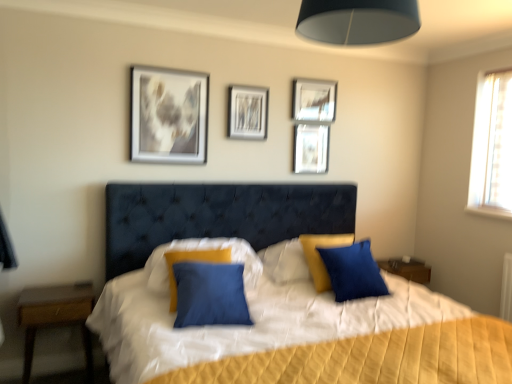
Image resolution: width=512 pixels, height=384 pixels. Describe the element at coordinates (357, 21) in the screenshot. I see `black fabric lampshade at upper center` at that location.

Consider the image. In order to face metallic silver picture frame at upper center, positioned as the 3th picture frame in right-to-left order, should I rotate leftwards or rightwards?

You should rotate left by 0.795 degrees.

Measure the distance between point [265,126] and camera.

They are 3.16 meters apart.

What do you see at coordinates (311, 149) in the screenshot? I see `matte silver picture frame at upper center, the third picture frame in the left-to-right sequence` at bounding box center [311, 149].

Where is `matte silver picture frame at upper center, which appears as the 2th picture frame when viewed from the right`? Image resolution: width=512 pixels, height=384 pixels. matte silver picture frame at upper center, which appears as the 2th picture frame when viewed from the right is located at coordinates (311, 149).

Identify the location of metallic silver picture frame at upper center, the 4th picture frame positioned from the left. (314, 100).

Locate an element on the screen. black fabric lampshade at upper center is located at coordinates (357, 21).

From a real-world perspective, is blue fabric pillow at center, which appears as the 1th pillow when viewed from the right, below metallic silver picture frame at upper center, which is the 1th picture frame in right-to-left order?

Yes.

What's the angular difference between blue fabric pillow at center, which appears as the 1th pillow when viewed from the right, and metallic silver picture frame at upper center, which is the 1th picture frame in right-to-left order,'s facing directions?

The angular difference between blue fabric pillow at center, which appears as the 1th pillow when viewed from the right, and metallic silver picture frame at upper center, which is the 1th picture frame in right-to-left order, is 8.01 degrees.

Does blue fabric pillow at center, acting as the 2th pillow starting from the left, have a smaller size compared to metallic silver picture frame at upper center, the 4th picture frame positioned from the left?

No.

Who is taller, blue fabric pillow at center, which appears as the 1th pillow when viewed from the right, or metallic silver picture frame at upper center, the 4th picture frame positioned from the left?

blue fabric pillow at center, which appears as the 1th pillow when viewed from the right, is taller.

Considering the positions of objects blue fabric pillow at center, the 2th pillow positioned from the right, and black fabric lampshade at upper center in the image provided, who is behind, blue fabric pillow at center, the 2th pillow positioned from the right, or black fabric lampshade at upper center?

blue fabric pillow at center, the 2th pillow positioned from the right, is further away from the camera.

Identify the location of lamp above the blue fabric pillow at center, the 2th pillow positioned from the right (from the image's perspective). The height and width of the screenshot is (384, 512). (357, 21).

Is blue fabric pillow at center, the first pillow in the left-to-right sequence, beside black fabric lampshade at upper center?

blue fabric pillow at center, the first pillow in the left-to-right sequence, and black fabric lampshade at upper center are clearly separated.

Does blue fabric pillow at center, the first pillow in the left-to-right sequence, appear on the right side of black fabric lampshade at upper center?

Incorrect, blue fabric pillow at center, the first pillow in the left-to-right sequence, is not on the right side of black fabric lampshade at upper center.

From a real-world perspective, is blue fabric pillow at center, acting as the 2th pillow starting from the left, under blue fabric pillow at center, the first pillow in the left-to-right sequence?

Yes, from a real-world perspective, blue fabric pillow at center, acting as the 2th pillow starting from the left, is below blue fabric pillow at center, the first pillow in the left-to-right sequence.

Is point (335, 277) in front of point (172, 288)?

That is False.

Looking at this image, between blue fabric pillow at center, acting as the 2th pillow starting from the left, and blue fabric pillow at center, the first pillow in the left-to-right sequence, which one has more height?

blue fabric pillow at center, acting as the 2th pillow starting from the left, is taller.

Based on their sizes in the image, would you say blue fabric pillow at center, which appears as the 1th pillow when viewed from the right, is bigger or smaller than blue fabric pillow at center, the first pillow in the left-to-right sequence?

blue fabric pillow at center, which appears as the 1th pillow when viewed from the right, is smaller than blue fabric pillow at center, the first pillow in the left-to-right sequence.

How many degrees apart are the facing directions of metallic silver picture frame at upper center, the 2th picture frame from the left, and metallic silver picture frame at upper center, which is the 1th picture frame in right-to-left order?

1.67 degrees.

From a real-world perspective, which object rests below the other?

In real-world perspective, metallic silver picture frame at upper center, positioned as the 3th picture frame in right-to-left order, is lower.

From the image's perspective, between metallic silver picture frame at upper center, positioned as the 3th picture frame in right-to-left order, and metallic silver picture frame at upper center, which is the 1th picture frame in right-to-left order, which one is located above?

From the image's view, metallic silver picture frame at upper center, which is the 1th picture frame in right-to-left order, is above.

Considering the sizes of metallic silver picture frame at upper center, the 2th picture frame from the left, and metallic silver picture frame at upper center, the 4th picture frame positioned from the left, in the image, is metallic silver picture frame at upper center, the 2th picture frame from the left, bigger or smaller than metallic silver picture frame at upper center, the 4th picture frame positioned from the left,?

metallic silver picture frame at upper center, the 2th picture frame from the left, is smaller than metallic silver picture frame at upper center, the 4th picture frame positioned from the left.

Considering the relative positions of metallic silver picture frame at upper center, the 4th picture frame positioned from the left, and metallic silver picture frame at upper center, the 2th picture frame from the left, in the image provided, is metallic silver picture frame at upper center, the 4th picture frame positioned from the left, to the right of metallic silver picture frame at upper center, the 2th picture frame from the left, from the viewer's perspective?

Yes, metallic silver picture frame at upper center, the 4th picture frame positioned from the left, is to the right of metallic silver picture frame at upper center, the 2th picture frame from the left.

Is metallic silver picture frame at upper center, the 4th picture frame positioned from the left, not near metallic silver picture frame at upper center, the 2th picture frame from the left?

metallic silver picture frame at upper center, the 4th picture frame positioned from the left, is near metallic silver picture frame at upper center, the 2th picture frame from the left, not far away.

What's the angular difference between metallic silver picture frame at upper center, the 4th picture frame positioned from the left, and metallic silver picture frame at upper center, the 2th picture frame from the left,'s facing directions?

The facing directions of metallic silver picture frame at upper center, the 4th picture frame positioned from the left, and metallic silver picture frame at upper center, the 2th picture frame from the left, are 1.67 degrees apart.

Who is shorter, matte silver picture frame at upper center, which appears as the 2th picture frame when viewed from the right, or metallic silver picture frame at upper center, the 4th picture frame from the right?

matte silver picture frame at upper center, which appears as the 2th picture frame when viewed from the right, is shorter.

Is point (321, 163) positioned behind point (180, 134)?

Yes, it is.

Based on the photo, how different are the orientations of matte silver picture frame at upper center, which appears as the 2th picture frame when viewed from the right, and metallic silver picture frame at upper center, the first picture frame positioned from the left, in degrees?

The angular difference between matte silver picture frame at upper center, which appears as the 2th picture frame when viewed from the right, and metallic silver picture frame at upper center, the first picture frame positioned from the left, is 0.00339 degrees.

Is matte silver picture frame at upper center, which appears as the 2th picture frame when viewed from the right, facing away from metallic silver picture frame at upper center, the first picture frame positioned from the left?

No, matte silver picture frame at upper center, which appears as the 2th picture frame when viewed from the right, is not facing away from metallic silver picture frame at upper center, the first picture frame positioned from the left.

Between blue fabric pillow at center, which appears as the 1th pillow when viewed from the right, and wooden nightstand at left, which one has more height?

wooden nightstand at left.

Looking at this image, is blue fabric pillow at center, which appears as the 1th pillow when viewed from the right, to the right of wooden nightstand at left from the viewer's perspective?

Yes, blue fabric pillow at center, which appears as the 1th pillow when viewed from the right, is to the right of wooden nightstand at left.

Identify the location of nightstand below the blue fabric pillow at center, which appears as the 1th pillow when viewed from the right (from the image's perspective). (56, 317).

Is blue fabric pillow at center, which appears as the 1th pillow when viewed from the right, positioned beyond the bounds of wooden nightstand at left?

Absolutely, blue fabric pillow at center, which appears as the 1th pillow when viewed from the right, is external to wooden nightstand at left.

Image resolution: width=512 pixels, height=384 pixels. In order to click on the 3rd picture frame behind the blue fabric pillow at center, which appears as the 1th pillow when viewed from the right, starting your count from the anchor in this screenshot , I will do `click(314, 100)`.

Identify the location of lamp on the right of the blue fabric pillow at center, the first pillow in the left-to-right sequence. (357, 21).

Looking at the image, which one is located further to blue fabric pillow at center, the first pillow in the left-to-right sequence, metallic silver picture frame at upper center, positioned as the 3th picture frame in right-to-left order, or wooden nightstand at left?

metallic silver picture frame at upper center, positioned as the 3th picture frame in right-to-left order, is positioned further to the anchor blue fabric pillow at center, the first pillow in the left-to-right sequence.

Looking at the image, which one is located closer to metallic silver picture frame at upper center, which is the 1th picture frame in right-to-left order, metallic silver picture frame at upper center, positioned as the 3th picture frame in right-to-left order, or blue fabric pillow at center, the 2th pillow positioned from the right?

metallic silver picture frame at upper center, positioned as the 3th picture frame in right-to-left order, is positioned closer to the anchor metallic silver picture frame at upper center, which is the 1th picture frame in right-to-left order.

Based on their spatial positions, is blue fabric pillow at center, which appears as the 1th pillow when viewed from the right, or metallic silver picture frame at upper center, positioned as the 3th picture frame in right-to-left order, closer to wooden nightstand at left?

Based on the image, metallic silver picture frame at upper center, positioned as the 3th picture frame in right-to-left order, appears to be nearer to wooden nightstand at left.

Estimate the real-world distances between objects in this image. Which object is closer to matte silver picture frame at upper center, the third picture frame in the left-to-right sequence, metallic silver picture frame at upper center, the 4th picture frame from the right, or metallic silver picture frame at upper center, which is the 1th picture frame in right-to-left order?

metallic silver picture frame at upper center, which is the 1th picture frame in right-to-left order, is closer to matte silver picture frame at upper center, the third picture frame in the left-to-right sequence.

Which object lies further to the anchor point blue fabric pillow at center, acting as the 2th pillow starting from the left, black fabric lampshade at upper center or matte silver picture frame at upper center, which appears as the 2th picture frame when viewed from the right?

The object further to blue fabric pillow at center, acting as the 2th pillow starting from the left, is black fabric lampshade at upper center.

When comparing their distances from blue fabric pillow at center, acting as the 2th pillow starting from the left, does metallic silver picture frame at upper center, the 2th picture frame from the left, or matte silver picture frame at upper center, which appears as the 2th picture frame when viewed from the right, seem closer?

matte silver picture frame at upper center, which appears as the 2th picture frame when viewed from the right, is closer to blue fabric pillow at center, acting as the 2th pillow starting from the left.

Consider the image. Based on their spatial positions, is blue fabric pillow at center, which appears as the 1th pillow when viewed from the right, or blue fabric pillow at center, the first pillow in the left-to-right sequence, closer to black fabric lampshade at upper center?

Among the two, blue fabric pillow at center, which appears as the 1th pillow when viewed from the right, is located nearer to black fabric lampshade at upper center.

Based on their spatial positions, is blue fabric pillow at center, the first pillow in the left-to-right sequence, or metallic silver picture frame at upper center, which is the 1th picture frame in right-to-left order, further from wooden nightstand at left?

Among the two, metallic silver picture frame at upper center, which is the 1th picture frame in right-to-left order, is located further to wooden nightstand at left.

Find the location of a particular element. pillow between metallic silver picture frame at upper center, the 2th picture frame from the left, and blue fabric pillow at center, acting as the 2th pillow starting from the left, in the up-down direction is located at coordinates (201, 260).

Where is `nightstand between black fabric lampshade at upper center and metallic silver picture frame at upper center, the 2th picture frame from the left, from front to back`? Image resolution: width=512 pixels, height=384 pixels. nightstand between black fabric lampshade at upper center and metallic silver picture frame at upper center, the 2th picture frame from the left, from front to back is located at coordinates (56, 317).

Identify the location of pillow between blue fabric pillow at center, the 2th pillow positioned from the right, and matte silver picture frame at upper center, which appears as the 2th picture frame when viewed from the right, in the front-back direction. The image size is (512, 384). (x=353, y=271).

Identify the location of pillow between wooden nightstand at left and matte silver picture frame at upper center, which appears as the 2th picture frame when viewed from the right. The width and height of the screenshot is (512, 384). (201, 260).